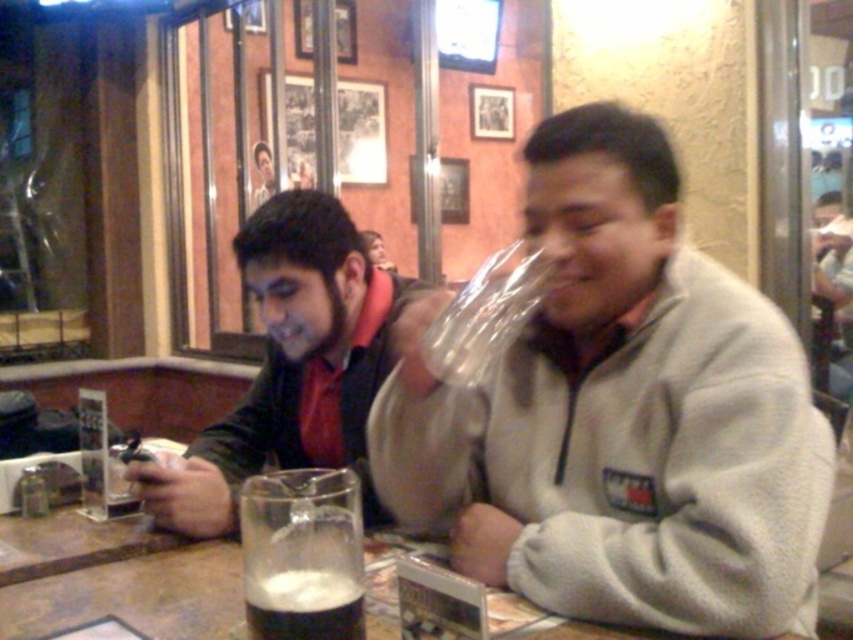
Is gray fleece jacket at center below foamy dark liquid at lower center?

No, gray fleece jacket at center is not below foamy dark liquid at lower center.

From the picture: Can you confirm if gray fleece jacket at center is bigger than foamy dark liquid at lower center?

Yes, gray fleece jacket at center is bigger than foamy dark liquid at lower center.

Is point (740, 422) more distant than point (277, 579)?

Yes, point (740, 422) is farther from viewer.

At what (x,y) coordinates should I click in order to perform the action: click on gray fleece jacket at center. Please return your answer as a coordinate pair (x, y). Image resolution: width=853 pixels, height=640 pixels. Looking at the image, I should click on (622, 417).

Is gray fleece jacket at center closer to camera compared to foamy dark liquid at center?

No, gray fleece jacket at center is further to the viewer.

Image resolution: width=853 pixels, height=640 pixels. In order to click on gray fleece jacket at center in this screenshot , I will do `click(622, 417)`.

Which is behind, point (779, 589) or point (262, 532)?

The point (779, 589) is more distant.

You are a GUI agent. You are given a task and a screenshot of the screen. Output one action in this format:
    pyautogui.click(x=<x>, y=<y>)
    Task: Click on the gray fleece jacket at center
    
    Given the screenshot: What is the action you would take?
    pyautogui.click(x=622, y=417)

Which is more to the right, matte black phone at left or foamy dark liquid at center?

Positioned to the right is foamy dark liquid at center.

Can you confirm if matte black phone at left is taller than foamy dark liquid at center?

Yes.

Which is behind, point (270, 241) or point (291, 499)?

Positioned behind is point (270, 241).

Where is `matte black phone at left`? matte black phone at left is located at coordinates (297, 364).